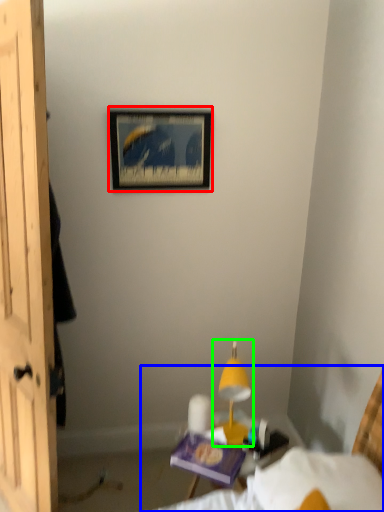
Question: Considering the real-world distances, which object is farthest from picture frame (highlighted by a red box)? bed (highlighted by a blue box) or table lamp (highlighted by a green box)?

Choices:
 (A) bed
 (B) table lamp

Answer: (A)